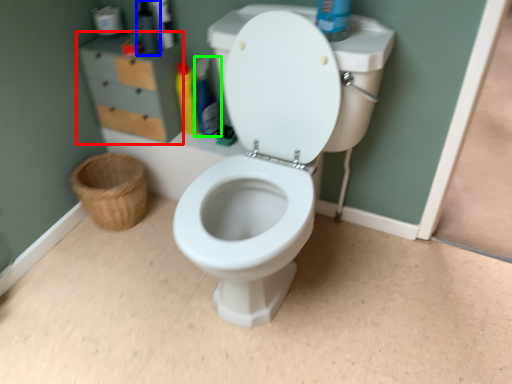
Question: Which object is positioned farthest from file cabinet (highlighted by a red box)? Select from toiletry (highlighted by a blue box) and cleaning product (highlighted by a green box).

Choices:
 (A) toiletry
 (B) cleaning product

Answer: (B)